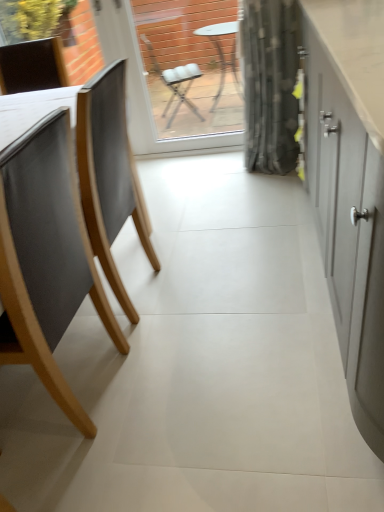
Question: Do you think matte gray cabinet at right is within matte wood chair at left, or outside of it?

Choices:
 (A) outside
 (B) inside

Answer: (A)

Question: Looking at their shapes, would you say matte gray cabinet at right is wider or thinner than matte wood chair at left?

Choices:
 (A) thin
 (B) wide

Answer: (B)

Question: Estimate the real-world distances between objects in this image. Which object is farther from the matte wood chair at left?

Choices:
 (A) matte gray cabinet at right
 (B) transparent glass window screen at center

Answer: (B)

Question: Which is nearer to the matte gray cabinet at right?

Choices:
 (A) matte wood chair at left
 (B) transparent glass window screen at center

Answer: (A)